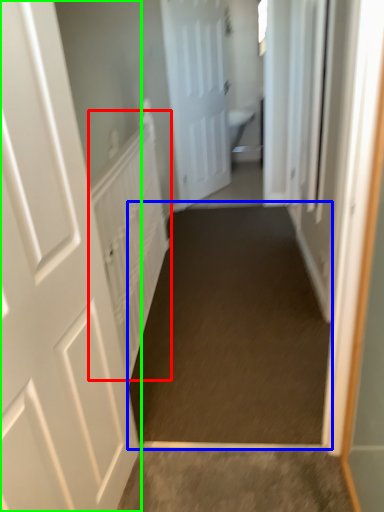
Question: Estimate the real-world distances between objects in this image. Which object is farther from radiator (highlighted by a red box), path (highlighted by a blue box) or door (highlighted by a green box)?

Choices:
 (A) path
 (B) door

Answer: (B)